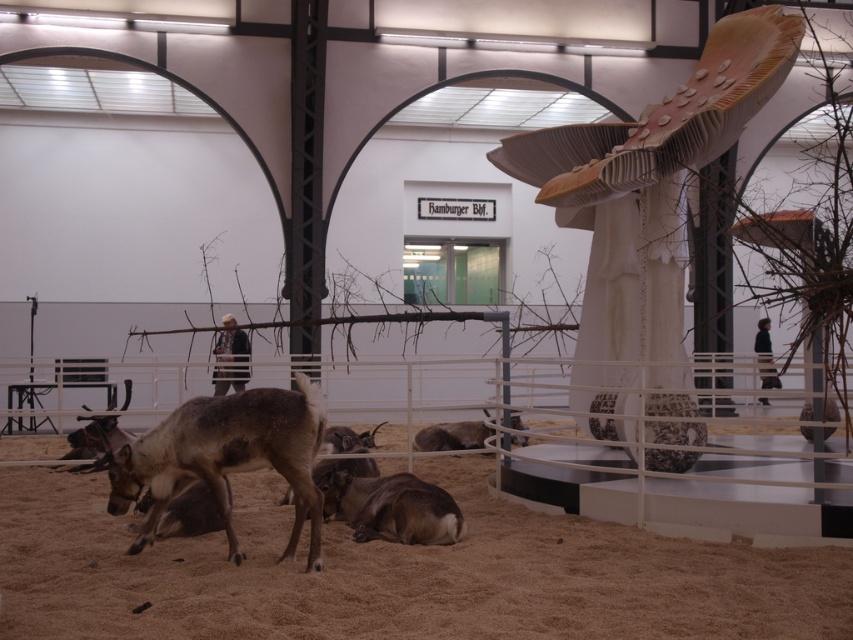
Question: Which object appears closest to the camera in this image?

Choices:
 (A) brown fur deer at center
 (B) brown sandy ground at lower center
 (C) wooden sculpture at center

Answer: (A)

Question: In this image, where is wooden sculpture at center located relative to brown fur deer at center?

Choices:
 (A) above
 (B) below

Answer: (A)

Question: Among these objects, which one is nearest to the camera?

Choices:
 (A) brown fur deer at center
 (B) wooden sculpture at center

Answer: (A)

Question: Where is brown sandy ground at lower center located in relation to brown fur deer at center in the image?

Choices:
 (A) right
 (B) left

Answer: (B)

Question: Does brown sandy ground at lower center have a smaller size compared to brown fur deer at center?

Choices:
 (A) yes
 (B) no

Answer: (A)

Question: Which of the following is the farthest from the observer?

Choices:
 (A) click(x=218, y=492)
 (B) click(x=607, y=342)
 (C) click(x=190, y=621)

Answer: (B)